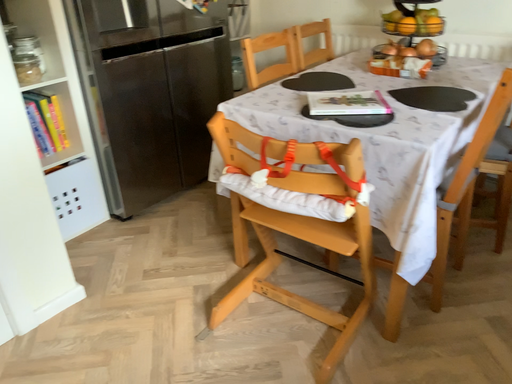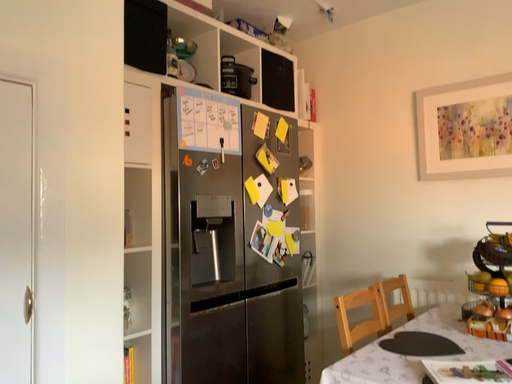
Question: Which way did the camera rotate in the video?

Choices:
 (A) rotated upward
 (B) rotated downward

Answer: (A)